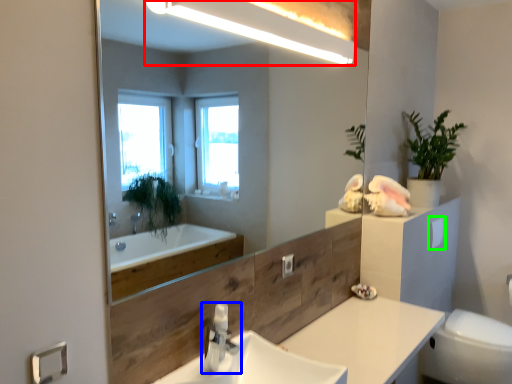
Question: Which is nearer to the light fixture (highlighted by a red box)? tap (highlighted by a blue box) or toilet paper (highlighted by a green box).

Choices:
 (A) tap
 (B) toilet paper

Answer: (A)